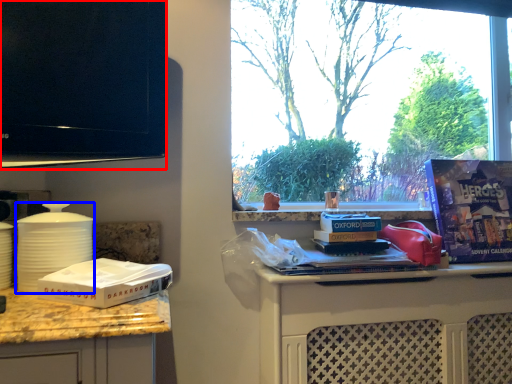
Question: Which point is closer to the camera, television (highlighted by a red box) or kitchen appliance (highlighted by a blue box)?

Choices:
 (A) television
 (B) kitchen appliance

Answer: (B)